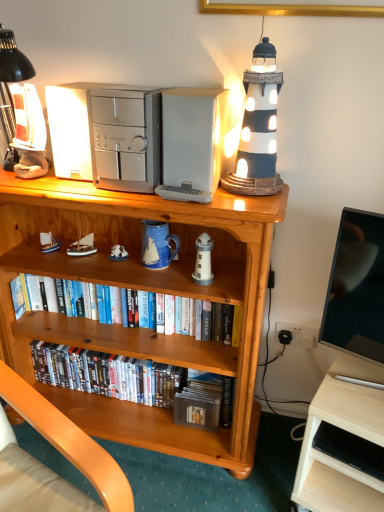
Locate an element on the screen. The height and width of the screenshot is (512, 384). vacant area that is in front of white plastic microwave at upper center, the third appliance when ordered from left to right is located at coordinates (225, 203).